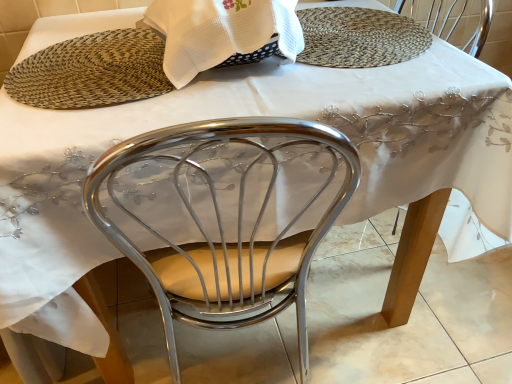
Locate an element on the screen. Image resolution: width=512 pixels, height=384 pixels. blank space situated above woven straw placemat at upper center (from a real-world perspective) is located at coordinates (356, 31).